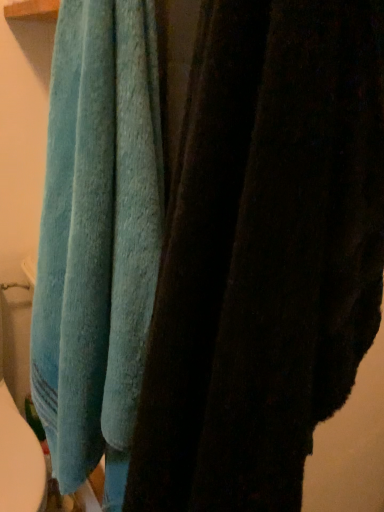
This screenshot has width=384, height=512. Find the location of `blue soft towel at upper left, the second towel positioned from the left`. blue soft towel at upper left, the second towel positioned from the left is located at coordinates (264, 254).

The image size is (384, 512). Describe the element at coordinates (264, 254) in the screenshot. I see `blue soft towel at upper left, the second towel positioned from the left` at that location.

The width and height of the screenshot is (384, 512). Identify the location of teal soft towel at left, which is counted as the second towel, starting from the right. (98, 238).

The width and height of the screenshot is (384, 512). Describe the element at coordinates (98, 238) in the screenshot. I see `teal soft towel at left, which is counted as the second towel, starting from the right` at that location.

I want to click on blue soft towel at upper left, the second towel positioned from the left, so click(264, 254).

Between blue soft towel at upper left, the second towel positioned from the left, and teal soft towel at left, placed as the 1th towel when sorted from left to right, which one appears on the left side from the viewer's perspective?

From the viewer's perspective, teal soft towel at left, placed as the 1th towel when sorted from left to right, appears more on the left side.

Does blue soft towel at upper left, the second towel positioned from the left, come behind teal soft towel at left, which is counted as the second towel, starting from the right?

No, blue soft towel at upper left, the second towel positioned from the left, is closer to the viewer.

Which is behind, point (239, 207) or point (120, 354)?

The point (120, 354) is farther.

Based on the photo, from the image's perspective, who appears lower, blue soft towel at upper left, the 1th towel from the right, or teal soft towel at left, which is counted as the second towel, starting from the right?

blue soft towel at upper left, the 1th towel from the right, from the image's perspective.

From a real-world perspective, does blue soft towel at upper left, the 1th towel from the right, sit lower than teal soft towel at left, which is counted as the second towel, starting from the right?

Incorrect, from a real-world perspective, blue soft towel at upper left, the 1th towel from the right, is higher than teal soft towel at left, which is counted as the second towel, starting from the right.

Consider the image. Considering the sizes of objects blue soft towel at upper left, the second towel positioned from the left, and teal soft towel at left, which is counted as the second towel, starting from the right, in the image provided, who is wider, blue soft towel at upper left, the second towel positioned from the left, or teal soft towel at left, which is counted as the second towel, starting from the right,?

Wider between the two is blue soft towel at upper left, the second towel positioned from the left.

Which of these two, blue soft towel at upper left, the 1th towel from the right, or teal soft towel at left, which is counted as the second towel, starting from the right, stands shorter?

blue soft towel at upper left, the 1th towel from the right, is shorter.

Considering the relative sizes of blue soft towel at upper left, the 1th towel from the right, and teal soft towel at left, which is counted as the second towel, starting from the right, in the image provided, is blue soft towel at upper left, the 1th towel from the right, bigger than teal soft towel at left, which is counted as the second towel, starting from the right,?

No.

From the picture: Would you say teal soft towel at left, placed as the 1th towel when sorted from left to right, is part of blue soft towel at upper left, the second towel positioned from the left,'s contents?

Definitely not — teal soft towel at left, placed as the 1th towel when sorted from left to right, is not inside blue soft towel at upper left, the second towel positioned from the left.

Are blue soft towel at upper left, the second towel positioned from the left, and teal soft towel at left, which is counted as the second towel, starting from the right, located far from each other?

That's not correct — blue soft towel at upper left, the second towel positioned from the left, is a little close to teal soft towel at left, which is counted as the second towel, starting from the right.

Could you tell me if blue soft towel at upper left, the 1th towel from the right, is turned towards teal soft towel at left, which is counted as the second towel, starting from the right?

No.

I want to click on towel behind the blue soft towel at upper left, the 1th towel from the right, so [x=98, y=238].

Considering the relative positions of teal soft towel at left, which is counted as the second towel, starting from the right, and blue soft towel at upper left, the 1th towel from the right, in the image provided, is teal soft towel at left, which is counted as the second towel, starting from the right, to the right of blue soft towel at upper left, the 1th towel from the right, from the viewer's perspective?

In fact, teal soft towel at left, which is counted as the second towel, starting from the right, is to the left of blue soft towel at upper left, the 1th towel from the right.

Is teal soft towel at left, placed as the 1th towel when sorted from left to right, positioned behind blue soft towel at upper left, the 1th towel from the right?

Yes.

Is point (88, 86) positioned before point (205, 114)?

No.

From the image's perspective, is teal soft towel at left, placed as the 1th towel when sorted from left to right, below blue soft towel at upper left, the 1th towel from the right?

No, from the image's perspective, teal soft towel at left, placed as the 1th towel when sorted from left to right, is not beneath blue soft towel at upper left, the 1th towel from the right.

From a real-world perspective, is teal soft towel at left, placed as the 1th towel when sorted from left to right, over blue soft towel at upper left, the second towel positioned from the left?

No.

Can you confirm if teal soft towel at left, placed as the 1th towel when sorted from left to right, is thinner than blue soft towel at upper left, the second towel positioned from the left?

Yes.

Considering the sizes of objects teal soft towel at left, which is counted as the second towel, starting from the right, and blue soft towel at upper left, the second towel positioned from the left, in the image provided, who is shorter, teal soft towel at left, which is counted as the second towel, starting from the right, or blue soft towel at upper left, the second towel positioned from the left,?

With less height is blue soft towel at upper left, the second towel positioned from the left.

Considering the sizes of objects teal soft towel at left, placed as the 1th towel when sorted from left to right, and blue soft towel at upper left, the second towel positioned from the left, in the image provided, who is bigger, teal soft towel at left, placed as the 1th towel when sorted from left to right, or blue soft towel at upper left, the second towel positioned from the left,?

Bigger between the two is teal soft towel at left, placed as the 1th towel when sorted from left to right.

Is teal soft towel at left, placed as the 1th towel when sorted from left to right, inside the boundaries of blue soft towel at upper left, the second towel positioned from the left, or outside?

teal soft towel at left, placed as the 1th towel when sorted from left to right, is spatially situated outside blue soft towel at upper left, the second towel positioned from the left.

Is teal soft towel at left, which is counted as the second towel, starting from the right, directly adjacent to blue soft towel at upper left, the 1th towel from the right?

teal soft towel at left, which is counted as the second towel, starting from the right, and blue soft towel at upper left, the 1th towel from the right, are clearly separated.

Is blue soft towel at upper left, the second towel positioned from the left, at the back of teal soft towel at left, which is counted as the second towel, starting from the right?

teal soft towel at left, which is counted as the second towel, starting from the right, is not turned away from blue soft towel at upper left, the second towel positioned from the left.

Could you measure the distance between teal soft towel at left, placed as the 1th towel when sorted from left to right, and blue soft towel at upper left, the 1th towel from the right?

teal soft towel at left, placed as the 1th towel when sorted from left to right, is 22.99 centimeters away from blue soft towel at upper left, the 1th towel from the right.

What are the coordinates of `towel below the teal soft towel at left, placed as the 1th towel when sorted from left to right (from the image's perspective)` in the screenshot? It's located at (264, 254).

Image resolution: width=384 pixels, height=512 pixels. In order to click on towel below the blue soft towel at upper left, the 1th towel from the right (from a real-world perspective) in this screenshot , I will do `click(98, 238)`.

The width and height of the screenshot is (384, 512). I want to click on towel that is below the teal soft towel at left, placed as the 1th towel when sorted from left to right (from the image's perspective), so click(264, 254).